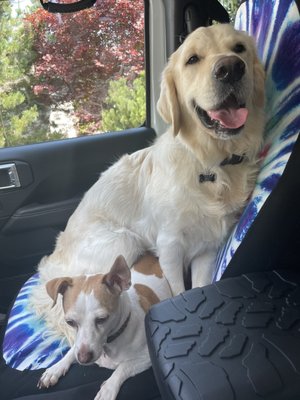
The height and width of the screenshot is (400, 300). Find the location of `tie dye seat cover`. tie dye seat cover is located at coordinates (285, 103).